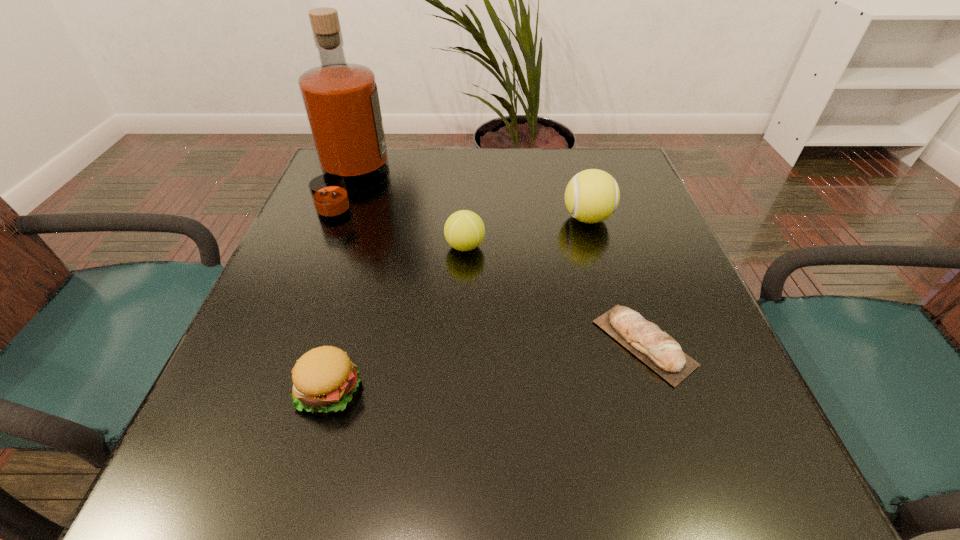
I want to click on vacant space that satisfies the following two spatial constraints: 1. on the front label of the tallest object; 2. on the right side of the shortest object, so click(x=293, y=343).

Locate an element on the screen. This screenshot has height=540, width=960. free region that satisfies the following two spatial constraints: 1. on the front label of the tallest object; 2. on the left side of the shorter tennis ball is located at coordinates (329, 246).

Identify the location of vacant point that satisfies the following two spatial constraints: 1. on the front label of the tallest object; 2. on the left side of the taller tennis ball. (340, 218).

You are a GUI agent. You are given a task and a screenshot of the screen. Output one action in this format:
    pyautogui.click(x=<x>, y=<y>)
    Task: Click on the vacant point that satisfies the following two spatial constraints: 1. on the front label of the tallest object; 2. on the left side of the right tennis ball
    
    Given the screenshot: What is the action you would take?
    pyautogui.click(x=340, y=218)

Where is `vacant area that satisfies the following two spatial constraints: 1. on the front label of the fourth tallest object; 2. on the left side of the liquor`? vacant area that satisfies the following two spatial constraints: 1. on the front label of the fourth tallest object; 2. on the left side of the liquor is located at coordinates (275, 390).

The width and height of the screenshot is (960, 540). Find the location of `free location that satisfies the following two spatial constraints: 1. on the front label of the liquor; 2. on the left side of the shorter tennis ball`. free location that satisfies the following two spatial constraints: 1. on the front label of the liquor; 2. on the left side of the shorter tennis ball is located at coordinates (329, 246).